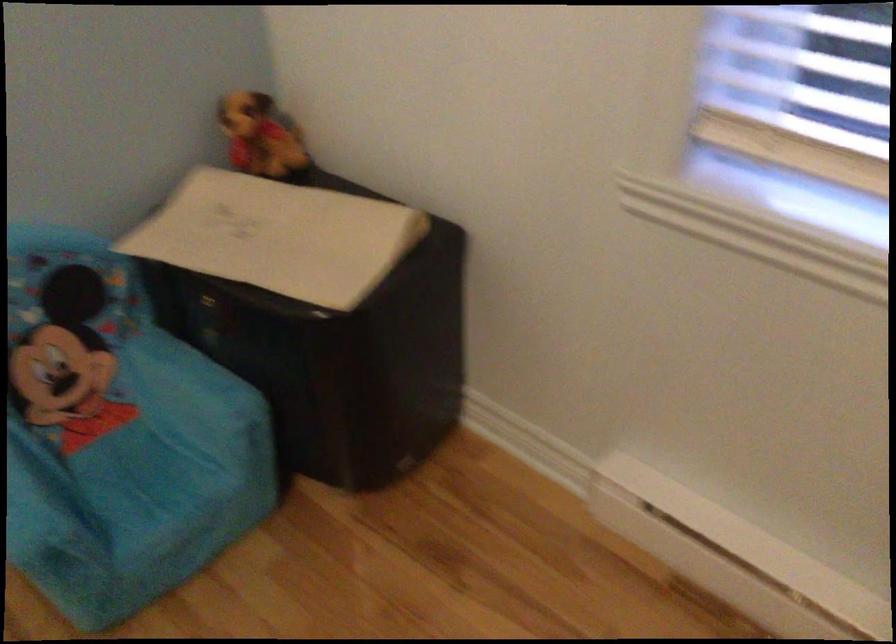
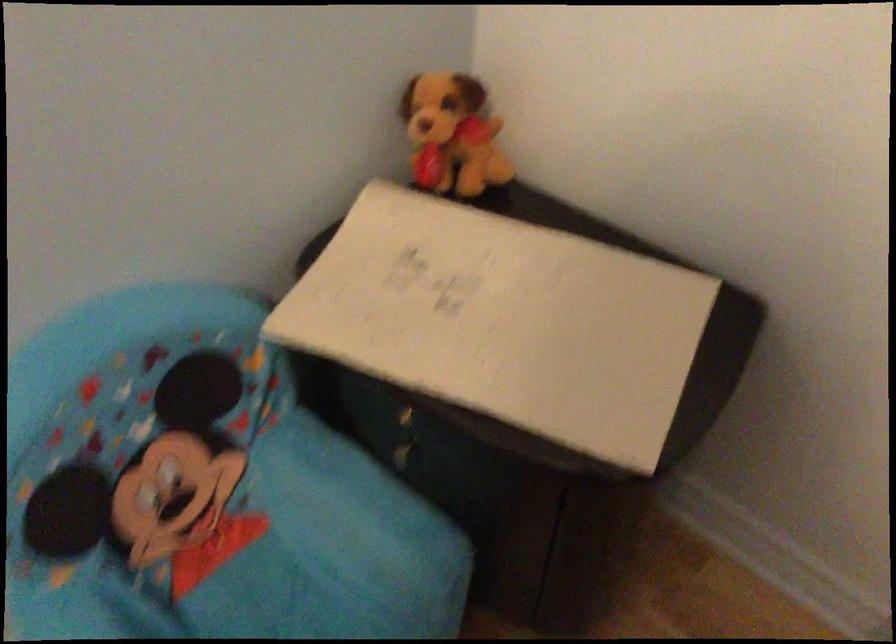
In a continuous first-person perspective shot, in which direction is the camera moving?

The cameraman walked toward left, forward.